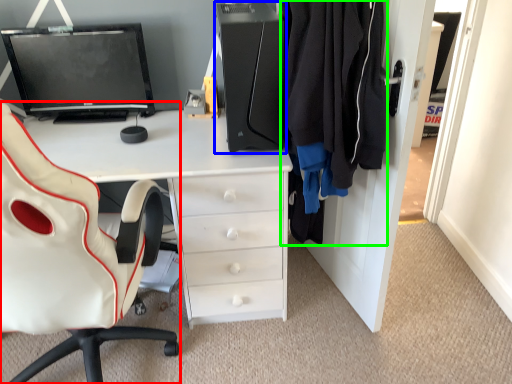
Question: Which object is positioned farthest from chair (highlighted by a red box)? Select from computer tower (highlighted by a blue box) and clothing (highlighted by a green box).

Choices:
 (A) computer tower
 (B) clothing

Answer: (B)